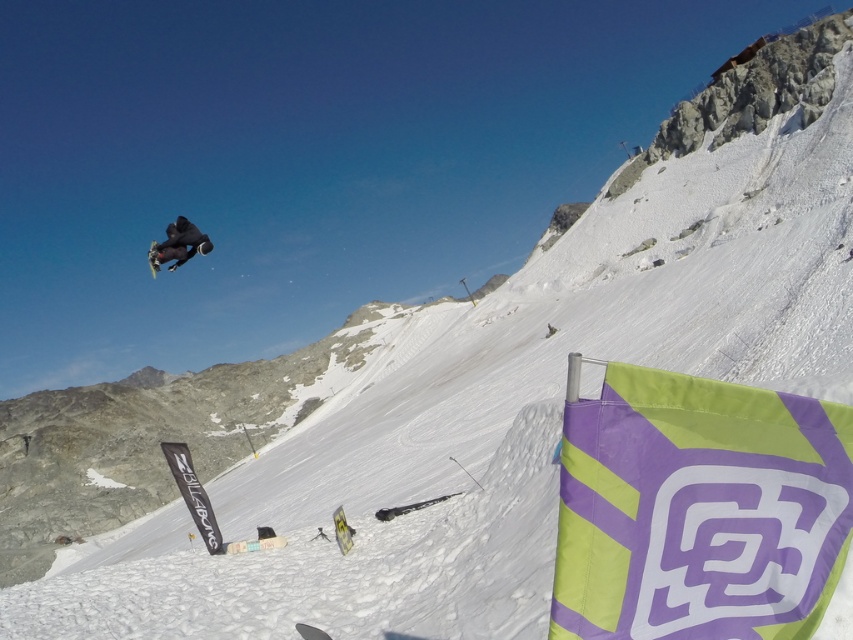
Is black matte snowboarder at upper center to the right of shiny black snowboard at upper left from the viewer's perspective?

Indeed, black matte snowboarder at upper center is positioned on the right side of shiny black snowboard at upper left.

Can you confirm if black matte snowboarder at upper center is bigger than shiny black snowboard at upper left?

Incorrect, black matte snowboarder at upper center is not larger than shiny black snowboard at upper left.

Image resolution: width=853 pixels, height=640 pixels. Identify the location of black matte snowboarder at upper center. (178, 244).

Where is `black matte snowboarder at upper center`? The image size is (853, 640). black matte snowboarder at upper center is located at coordinates (178, 244).